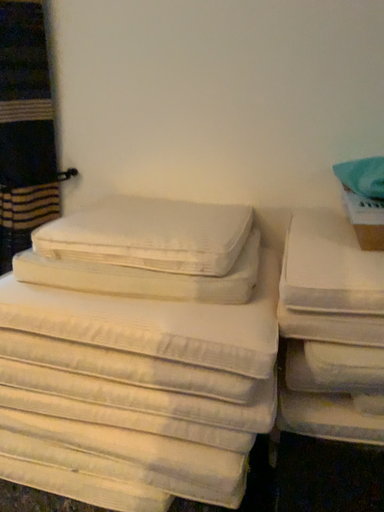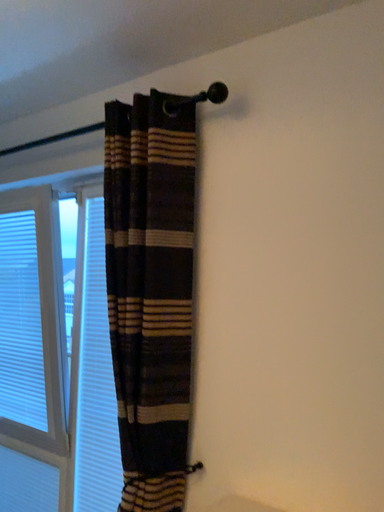
Question: Which way did the camera rotate in the video?

Choices:
 (A) rotated upward
 (B) rotated downward

Answer: (A)